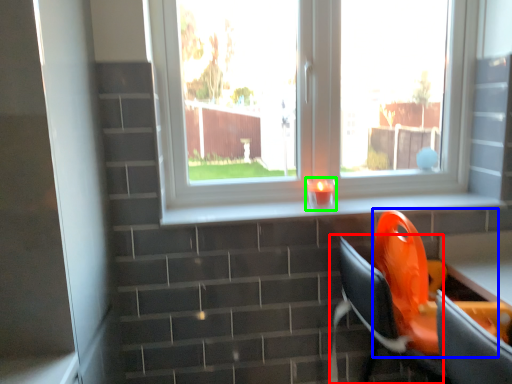
Question: Which object is the farthest from computer chair (highlighted by a red box)? Choose among these: swivel chair (highlighted by a blue box) or candle holder (highlighted by a green box).

Choices:
 (A) swivel chair
 (B) candle holder

Answer: (B)